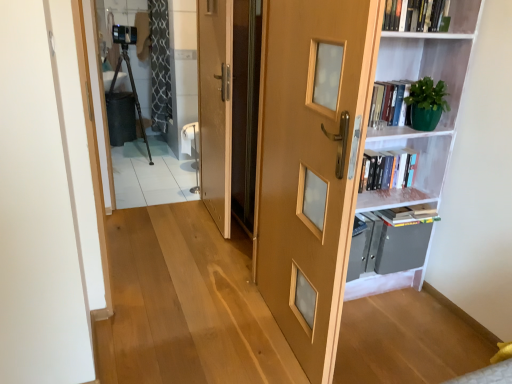
Locate an element on the screen. vacant area situated below wooden door at center, which ranks as the first door in back-to-front order (from a real-world perspective) is located at coordinates (210, 221).